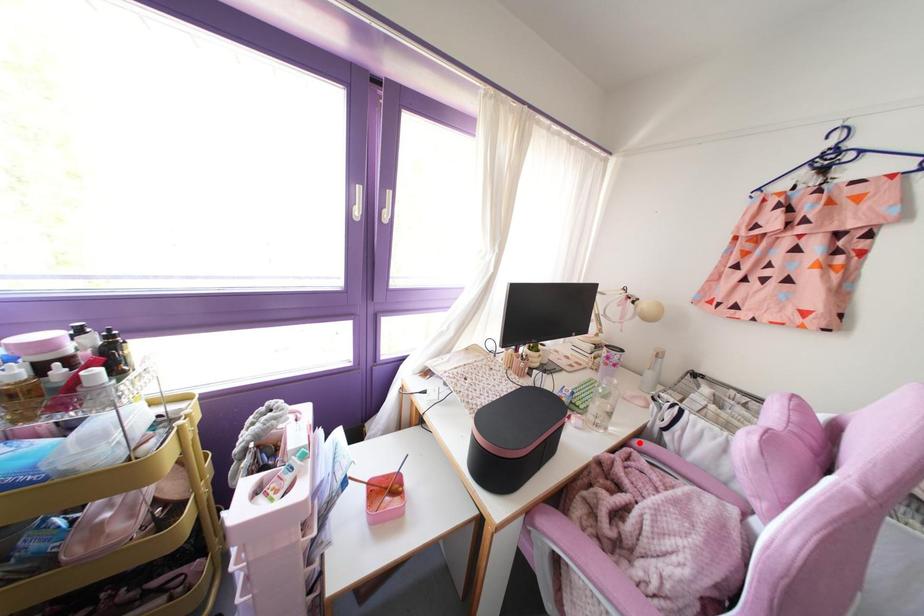
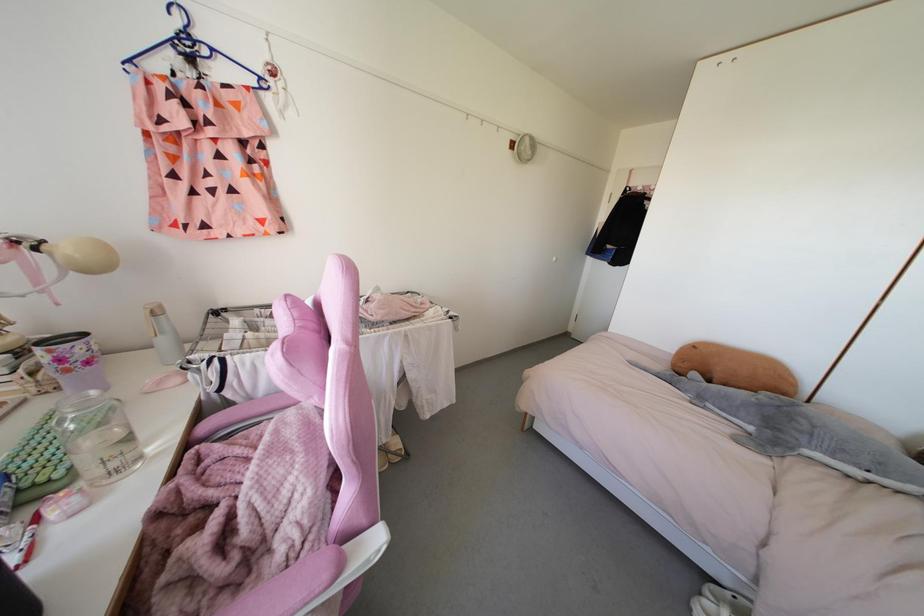
In the second image, find the point that corresponds to the highlighted location in the first image.

(204, 426)